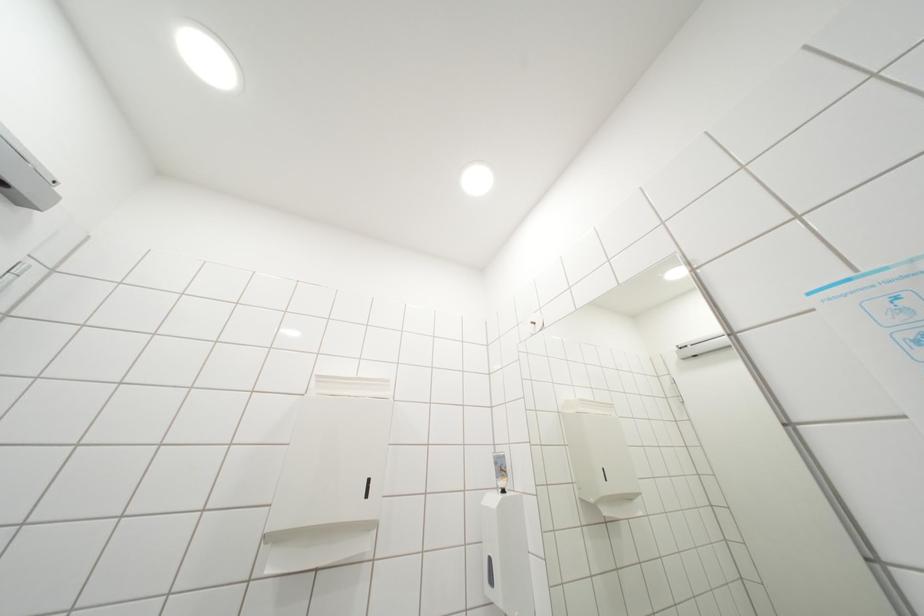
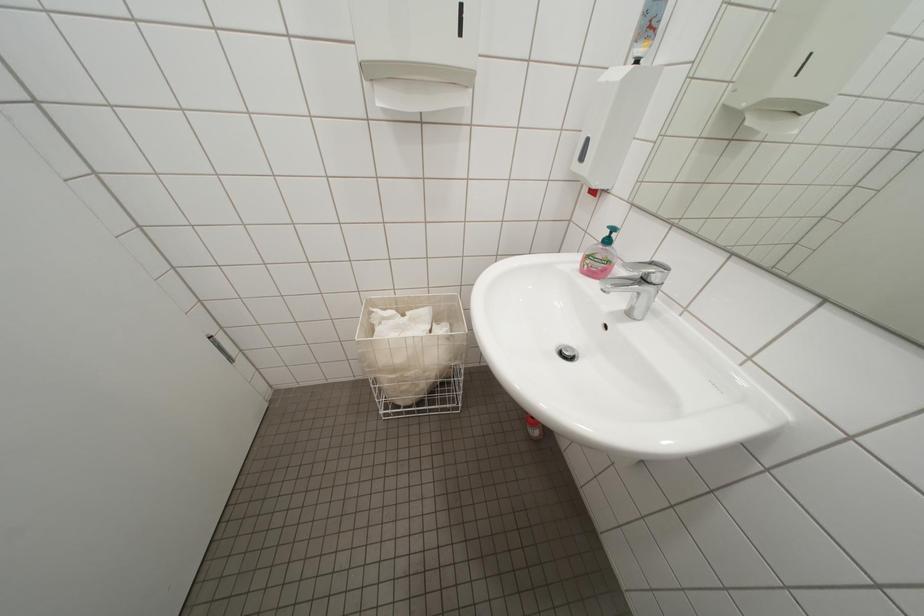
The first image is from the beginning of the video and the second image is from the end. How did the camera likely rotate when shooting the video?

The camera rotated toward left-down.